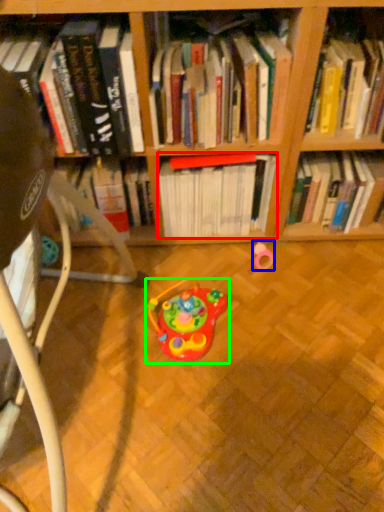
Question: Considering the real-world distances, which object is farthest from book (highlighted by a red box)? toy (highlighted by a blue box) or toy (highlighted by a green box)?

Choices:
 (A) toy
 (B) toy

Answer: (B)